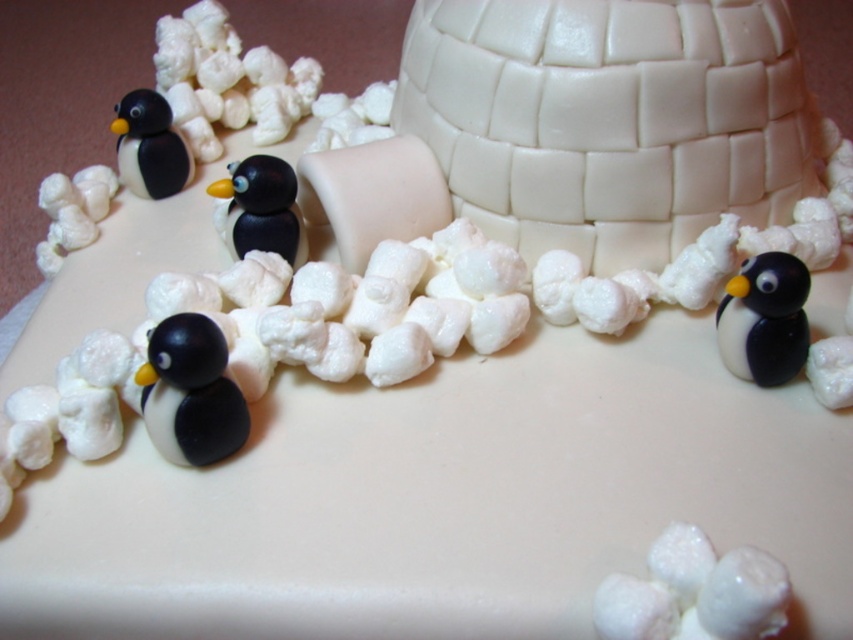
Question: Is black glossy penguin at lower right closer to camera compared to matte black penguin at center?

Choices:
 (A) yes
 (B) no

Answer: (A)

Question: Estimate the real-world distances between objects in this image. Which object is farther from the black matte penguin at upper left?

Choices:
 (A) black glossy penguin at lower right
 (B) matte black penguin at lower left

Answer: (A)

Question: Is matte black penguin at lower left to the left of matte black penguin at center from the viewer's perspective?

Choices:
 (A) no
 (B) yes

Answer: (A)

Question: Among these objects, which one is farthest from the camera?

Choices:
 (A) black glossy penguin at lower right
 (B) black matte penguin at upper left
 (C) matte black penguin at lower left

Answer: (B)

Question: Which point is farther to the camera?

Choices:
 (A) matte black penguin at center
 (B) matte black penguin at lower left

Answer: (A)

Question: Does matte black penguin at lower left have a larger size compared to matte black penguin at center?

Choices:
 (A) no
 (B) yes

Answer: (A)